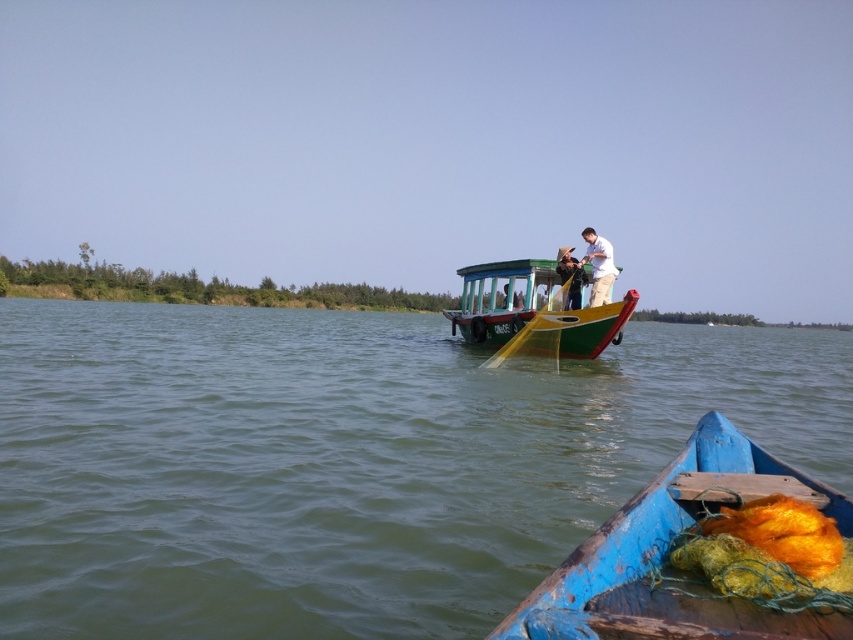
From the picture: You are on a boat and want to locate the white matte shirt at upper right. Which direction should you look relative to the green painted wood boat at center?

You should look upwards and to the right relative to the green painted wood boat at center to find the white matte shirt at upper right, as the shirt is positioned above the boat.

You are planning to take a photo of the green painted wood boat at center and the white matte shirt at upper right. Which object should you focus on first if you want to capture both in the same frame without moving the camera?

The green painted wood boat at center is larger in size than the white matte shirt at upper right, so you should focus on the larger object first to ensure both fit in the frame.

You are standing on the deck of a boat and want to reach a point marked at coordinates [593,563]. If your arm can reach 2 meters, can you reach that point without moving?

The point at coordinates [593,563] is 2.65 meters away from the viewer. Since your arm can only reach 2 meters, you cannot reach that point without moving.